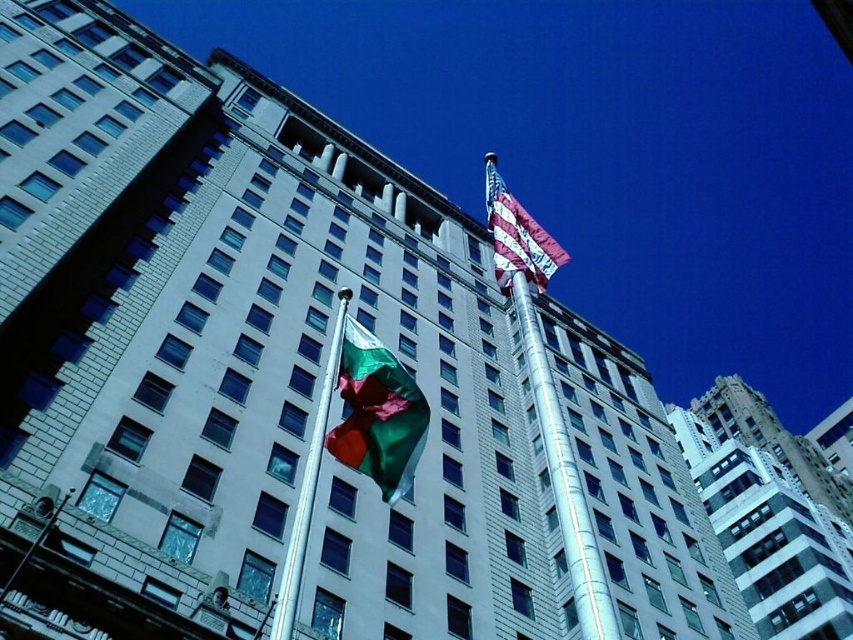
You are standing in front of the building and notice two flagpoles. The silver metallic mast at center and the silver metallic pole at center. Which one is positioned to the right?

The silver metallic mast at center is to the right of the silver metallic pole at center.

You are standing at the base of the silver metallic mast at center. You want to walk directly towards the building. How many steps would you need to take to reach the building if each step covers approximately 3 feet?

The silver metallic mast at center is 69.46 feet from camera. Assuming you are at the base of the mast, you would need to take approximately 23 steps to reach the building, since 69.46 divided by 3 equals approximately 23.15 steps.